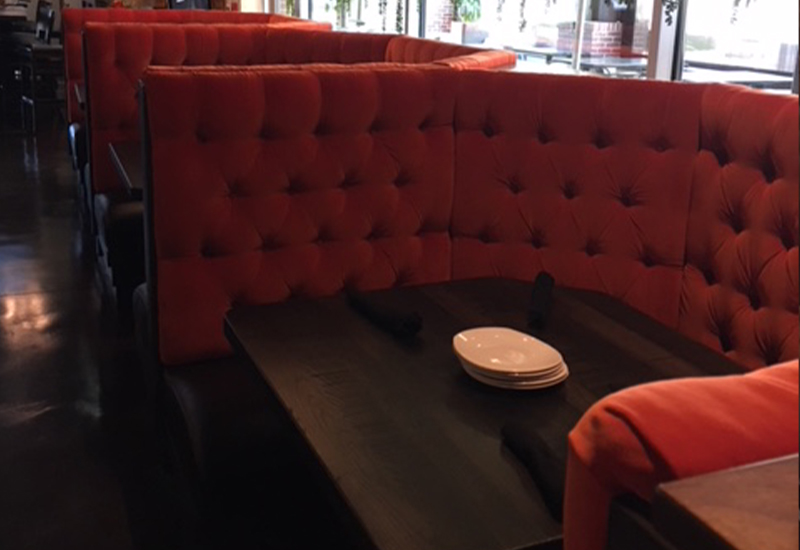
Identify the location of furthest end of restaurant. The image size is (800, 550). (30, 13).